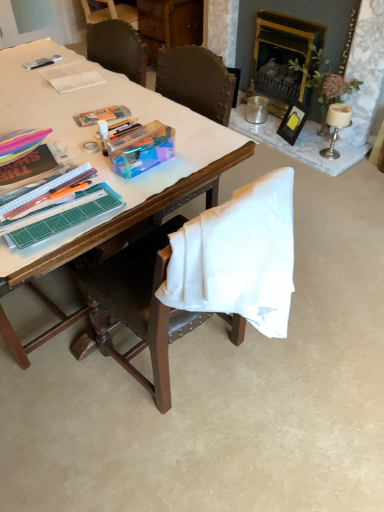
What are the coordinates of `free point to the right of white paper at upper left` in the screenshot? It's located at (122, 86).